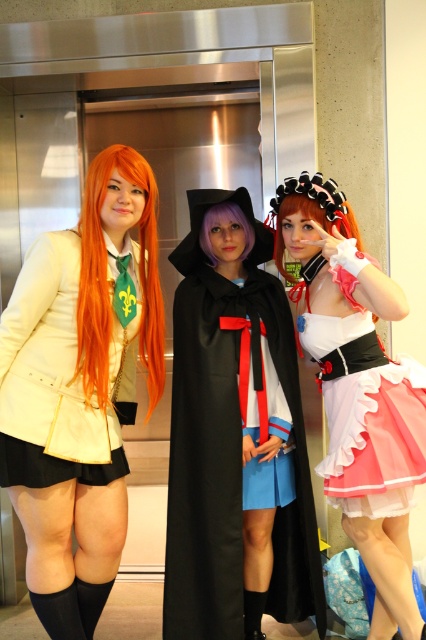
Question: Which point is farther from the camera taking this photo?

Choices:
 (A) (42, 564)
 (B) (367, 312)

Answer: (B)

Question: Is the position of matte white dress at center more distant than that of matte white blazer at left?

Choices:
 (A) no
 (B) yes

Answer: (B)

Question: Estimate the real-world distances between objects in this image. Which object is closer to the black matte cape at center?

Choices:
 (A) matte white coat at center
 (B) matte white dress at center

Answer: (B)

Question: Does matte white coat at center have a greater width compared to pink satin dress at center?

Choices:
 (A) yes
 (B) no

Answer: (A)

Question: From the image, what is the correct spatial relationship of matte white dress at center in relation to matte white blazer at left?

Choices:
 (A) above
 (B) below

Answer: (B)

Question: Among these points, which one is farthest from the camera?

Choices:
 (A) (37, 365)
 (B) (374, 387)
 (C) (203, 252)
 (D) (313, 243)

Answer: (C)